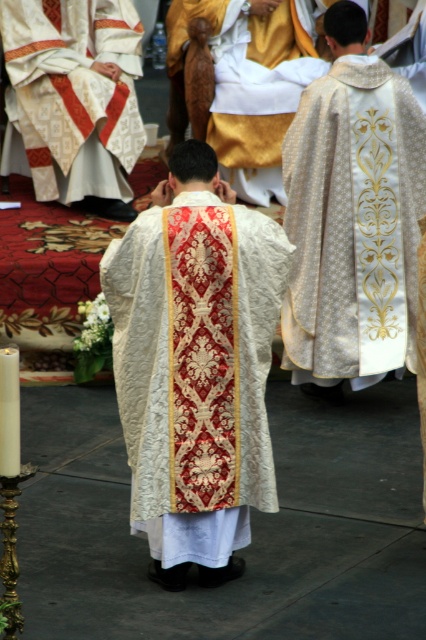
Question: Is embroidered silk vestment at center further to the viewer compared to silver metallic vestment at center?

Choices:
 (A) yes
 (B) no

Answer: (B)

Question: Does embroidered silk vestment at center have a larger size compared to white embroidered vestment at center?

Choices:
 (A) no
 (B) yes

Answer: (A)

Question: Which point is farther to the camera?

Choices:
 (A) embroidered silk vestment at center
 (B) silver metallic vestment at center

Answer: (B)

Question: Estimate the real-world distances between objects in this image. Which object is closer to the silver metallic vestment at center?

Choices:
 (A) embroidered silk vestment at center
 (B) white embroidered vestment at center

Answer: (A)

Question: Based on their relative distances, which object is nearer to the white embroidered vestment at center?

Choices:
 (A) silver metallic vestment at center
 (B) embroidered silk vestment at center

Answer: (A)

Question: Does embroidered silk vestment at center have a larger size compared to white embroidered vestment at center?

Choices:
 (A) yes
 (B) no

Answer: (B)